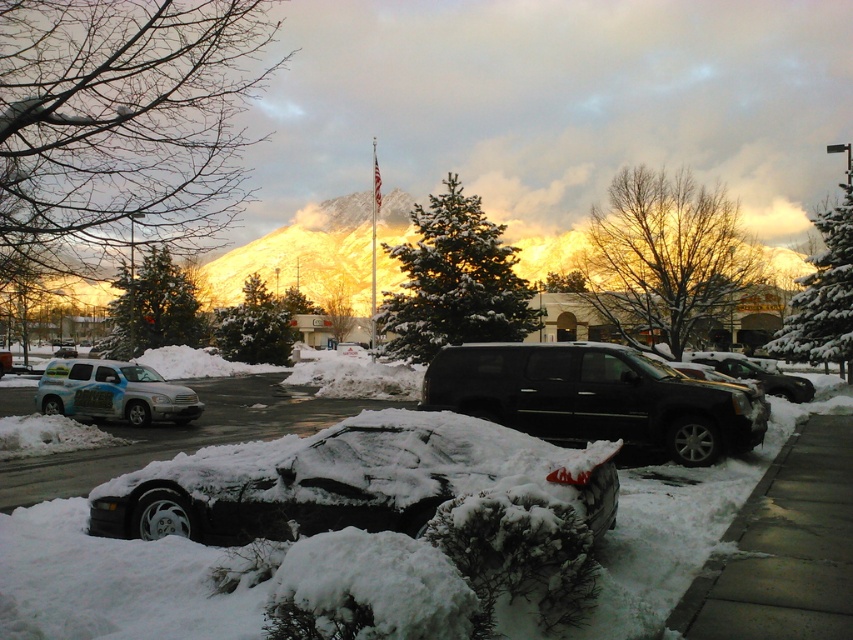
Is concrete at lower right closer to camera compared to matte metallic suv at left?

Yes, concrete at lower right is closer to the viewer.

Is concrete at lower right to the right of matte metallic suv at left from the viewer's perspective?

Indeed, concrete at lower right is positioned on the right side of matte metallic suv at left.

Is point (782, 584) closer to camera compared to point (67, 388)?

Yes, it is in front of point (67, 388).

Where is `concrete at lower right`? concrete at lower right is located at coordinates (784, 548).

The image size is (853, 640). Find the location of `snow-covered sedan at center`. snow-covered sedan at center is located at coordinates 343,481.

What do you see at coordinates (343, 481) in the screenshot? The width and height of the screenshot is (853, 640). I see `snow-covered sedan at center` at bounding box center [343, 481].

Does point (415, 500) come closer to viewer compared to point (798, 390)?

Yes.

At what (x,y) coordinates should I click in order to perform the action: click on snow-covered sedan at center. Please return your answer as a coordinate pair (x, y). Looking at the image, I should click on (343, 481).

Can you confirm if black matte suv at center is thinner than concrete at lower right?

Incorrect, black matte suv at center's width is not less than concrete at lower right's.

Between point (590, 412) and point (828, 566), which one is positioned behind?

The point (590, 412) is more distant.

Which is behind, point (450, 387) or point (767, 564)?

The point (450, 387) is more distant.

Find the location of a particular element. black matte suv at center is located at coordinates (595, 397).